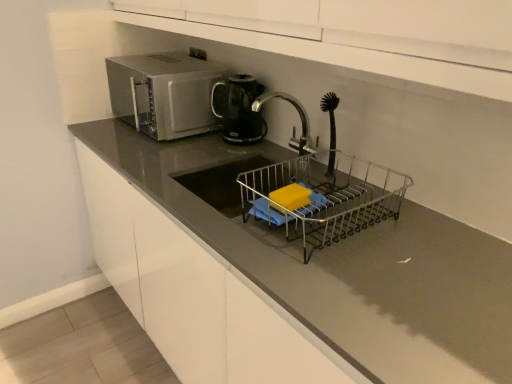
Question: Is point (286, 208) positioned closer to the camera than point (266, 172)?

Choices:
 (A) farther
 (B) closer

Answer: (B)

Question: Would you say yellow sponge at sink is to the left or to the right of metallic wire dish rack at center in the picture?

Choices:
 (A) left
 (B) right

Answer: (A)

Question: Which object is positioned farthest from the yellow sponge at sink?

Choices:
 (A) matte gray countertop at center
 (B) satin silver microwave at upper left
 (C) black plastic kettle at upper center
 (D) metallic wire dish rack at center
 (E) silver metallic tap at center

Answer: (B)

Question: Which of these objects is positioned closest to the satin silver microwave at upper left?

Choices:
 (A) matte gray countertop at center
 (B) silver metallic tap at center
 (C) black plastic kettle at upper center
 (D) metallic wire dish rack at center
 (E) yellow sponge at sink

Answer: (C)